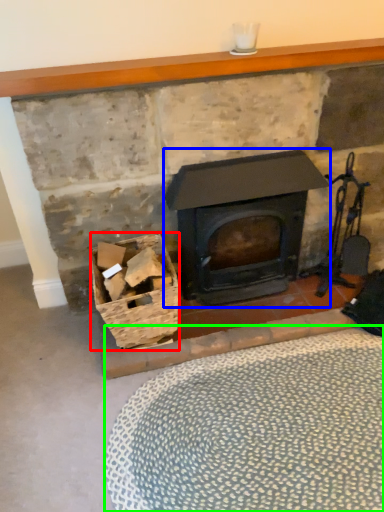
Question: Considering the real-world distances, which object is farthest from basket (highlighted by a red box)? wood burning stove (highlighted by a blue box) or plain (highlighted by a green box)?

Choices:
 (A) wood burning stove
 (B) plain

Answer: (B)